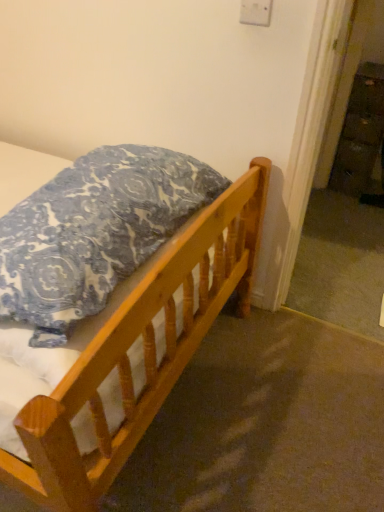
At what (x,y) coordinates should I click in order to perform the action: click on vacant area on top of wooden bed at lower left (from a real-world perspective). Please return your answer as a coordinate pair (x, y). Looking at the image, I should click on (236, 417).